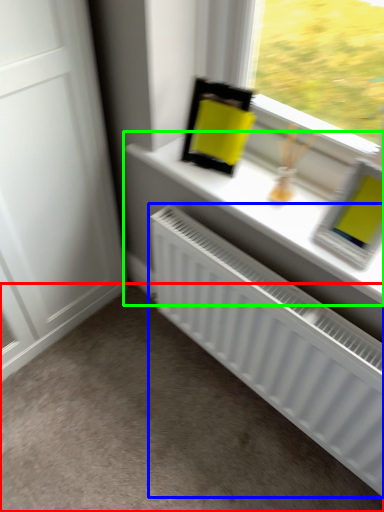
Question: Based on their relative distances, which object is farther from plain (highlighted by a red box)? Choose from radiator (highlighted by a blue box) and window sill (highlighted by a green box).

Choices:
 (A) radiator
 (B) window sill

Answer: (B)